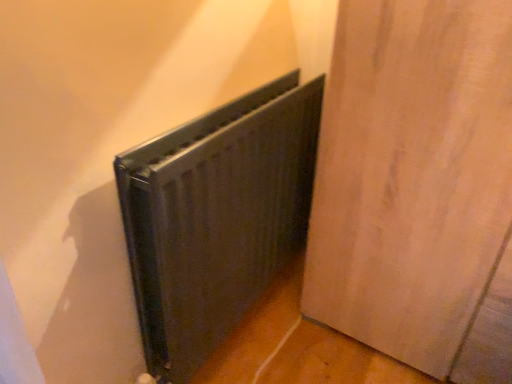
Question: Considering the relative sizes of black matte radiator at center and matte wood door at center in the image provided, is black matte radiator at center thinner than matte wood door at center?

Choices:
 (A) no
 (B) yes

Answer: (B)

Question: Is black matte radiator at center looking in the opposite direction of matte wood door at center?

Choices:
 (A) yes
 (B) no

Answer: (B)

Question: From the image's perspective, is black matte radiator at center located beneath matte wood door at center?

Choices:
 (A) yes
 (B) no

Answer: (A)

Question: Is black matte radiator at center far from matte wood door at center?

Choices:
 (A) yes
 (B) no

Answer: (B)

Question: Is black matte radiator at center taller than matte wood door at center?

Choices:
 (A) no
 (B) yes

Answer: (A)

Question: Is matte wood door at center inside black matte radiator at center?

Choices:
 (A) yes
 (B) no

Answer: (B)

Question: From a real-world perspective, is matte wood door at center beneath black matte radiator at center?

Choices:
 (A) yes
 (B) no

Answer: (B)

Question: Is matte wood door at center positioned far away from black matte radiator at center?

Choices:
 (A) yes
 (B) no

Answer: (B)

Question: Is matte wood door at center to the right of black matte radiator at center from the viewer's perspective?

Choices:
 (A) no
 (B) yes

Answer: (B)

Question: Is matte wood door at center behind black matte radiator at center?

Choices:
 (A) yes
 (B) no

Answer: (B)

Question: From the image's perspective, is matte wood door at center over black matte radiator at center?

Choices:
 (A) yes
 (B) no

Answer: (A)

Question: Is matte wood door at center bigger than black matte radiator at center?

Choices:
 (A) yes
 (B) no

Answer: (A)

Question: In terms of size, does matte wood door at center appear bigger or smaller than black matte radiator at center?

Choices:
 (A) big
 (B) small

Answer: (A)